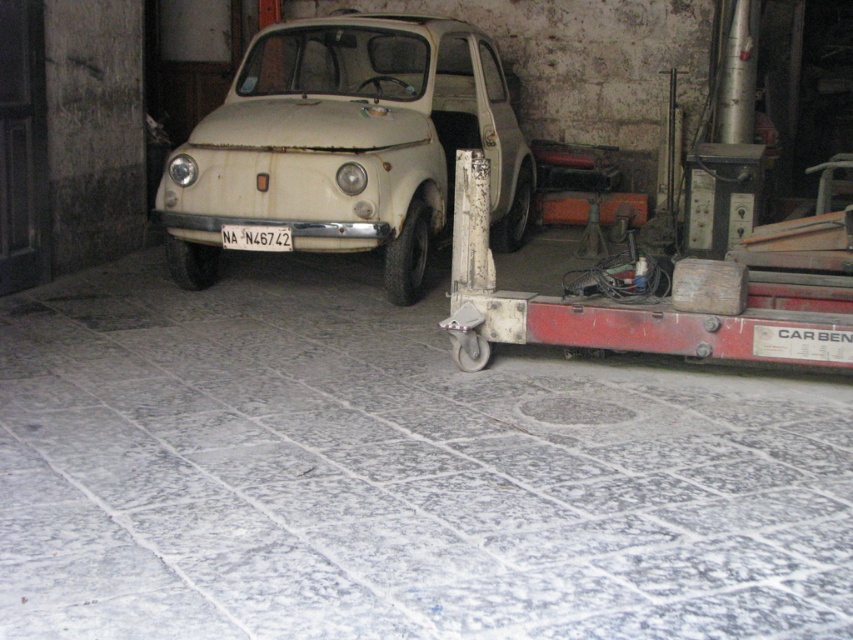
Is white matte car at center taller than white plastic license plate at center?

Yes, white matte car at center is taller than white plastic license plate at center.

Is white matte car at center closer to camera compared to white plastic license plate at center?

Yes, it is in front of white plastic license plate at center.

Where is `white matte car at center`? white matte car at center is located at coordinates 347,145.